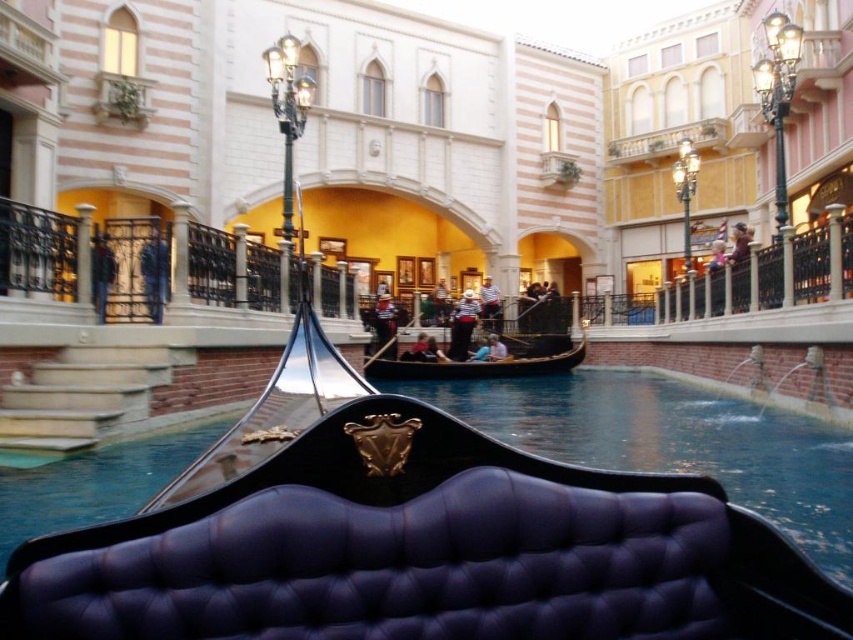
You are standing at the edge of the canal and notice the glossy black gondola at center and the black wrought iron railing at upper center. Which object appears larger in the scene?

The black wrought iron railing at upper center appears larger than the glossy black gondola at center in the scene.

You are standing at the entrance of the Venetian area and want to find the black wrought iron railing at upper center. According to the scene, where should you look relative to your position?

The black wrought iron railing at upper center is located at point 0.417 on the horizontal axis and 0.155 on the vertical axis from your viewpoint.

You are standing near the black wrought iron railing at upper center and want to walk to the black polished wood gondola at center. Which direction should you move to get closer to the gondola?

You should move away from the black wrought iron railing at upper center because it is closer to you than the black polished wood gondola at center.